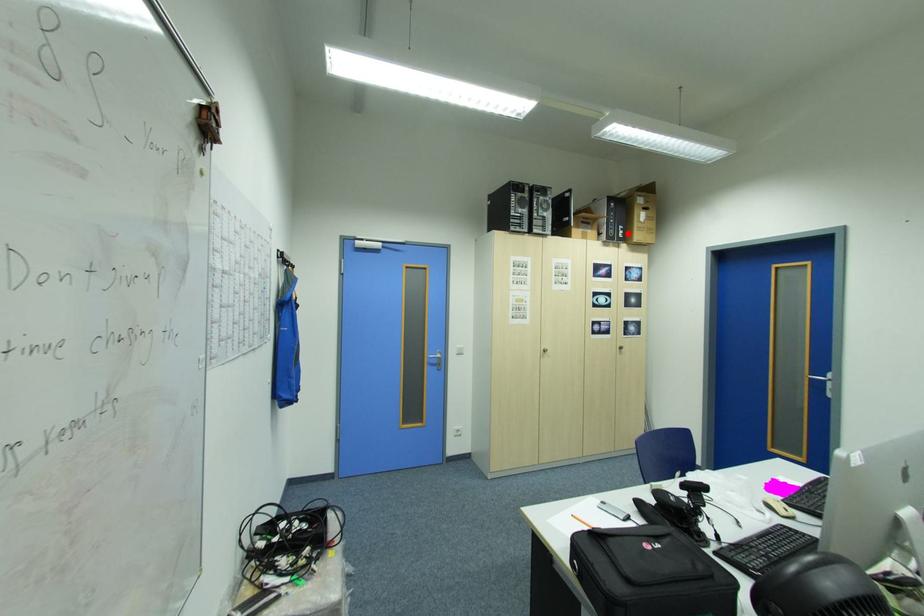
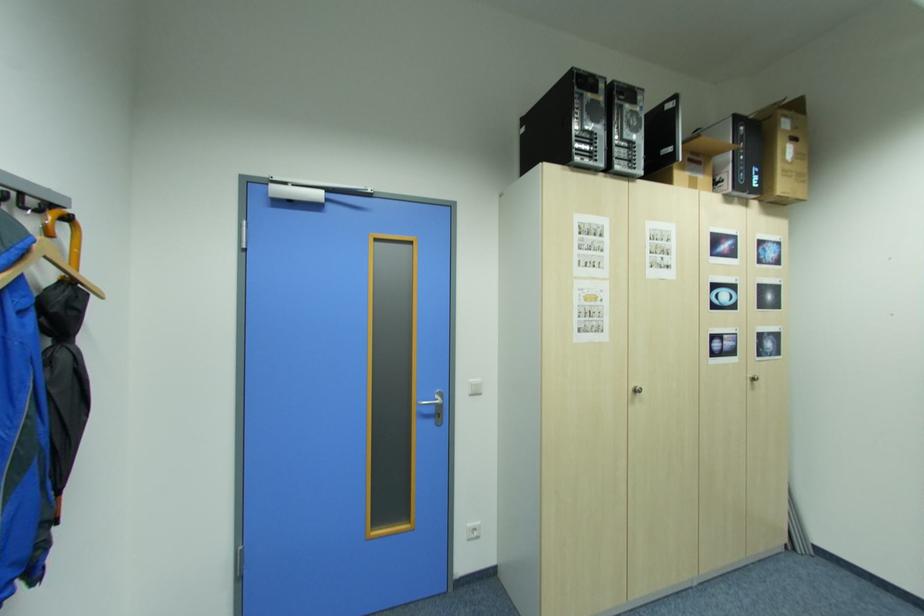
Question: I am providing you with two images of the same scene from different viewpoints. Image1 has a red point marked. In image2, the corresponding 3D location appears at what relative position? Reply with the corresponding letter.

Choices:
 (A) Closer
 (B) Farther

Answer: (B)